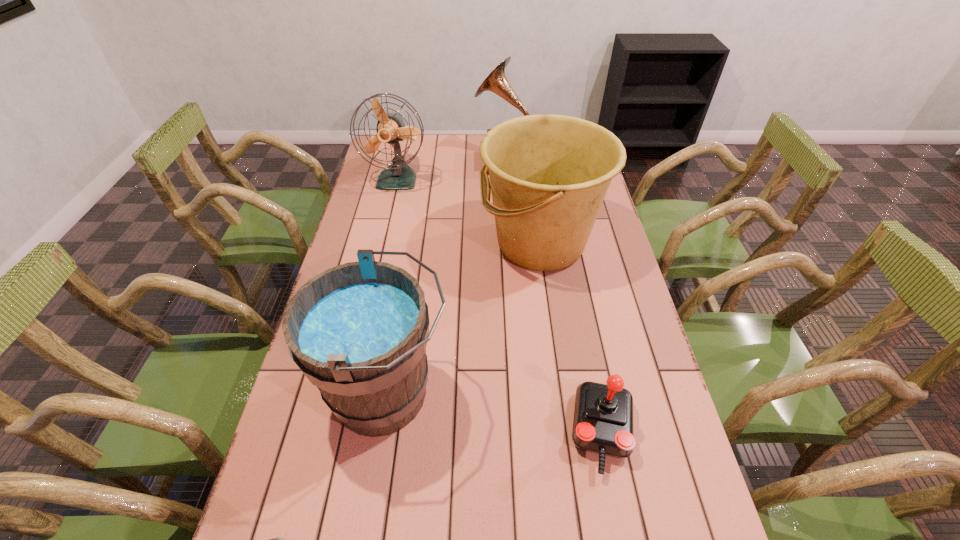
At what (x,y) coordinates should I click in order to perform the action: click on record player. Please return your answer as a coordinate pair (x, y). This screenshot has height=540, width=960. Looking at the image, I should click on (496, 81).

Find the location of `the fourth nearest object`. the fourth nearest object is located at coordinates (549, 174).

Locate an element on the screen. Image resolution: width=960 pixels, height=540 pixels. fan is located at coordinates (391, 129).

Locate an element on the screen. This screenshot has height=540, width=960. wine bucket is located at coordinates (358, 331).

Locate an element on the screen. The width and height of the screenshot is (960, 540). joystick is located at coordinates (603, 416).

At what (x,y) coordinates should I click in order to perform the action: click on vacant space located on the horn of the record player. Please return your answer as a coordinate pair (x, y). Image resolution: width=960 pixels, height=540 pixels. Looking at the image, I should click on (420, 158).

The height and width of the screenshot is (540, 960). I want to click on vacant space situated on the horn of the record player, so click(420, 158).

The width and height of the screenshot is (960, 540). I want to click on free space located 0.270m on the horn of the record player, so click(410, 158).

Identify the location of free space located on the side of the third farthest object with the handle. This screenshot has height=540, width=960. (428, 244).

Find the location of a particular element. This screenshot has width=960, height=540. vacant position located on the side of the third farthest object with the handle is located at coordinates (374, 244).